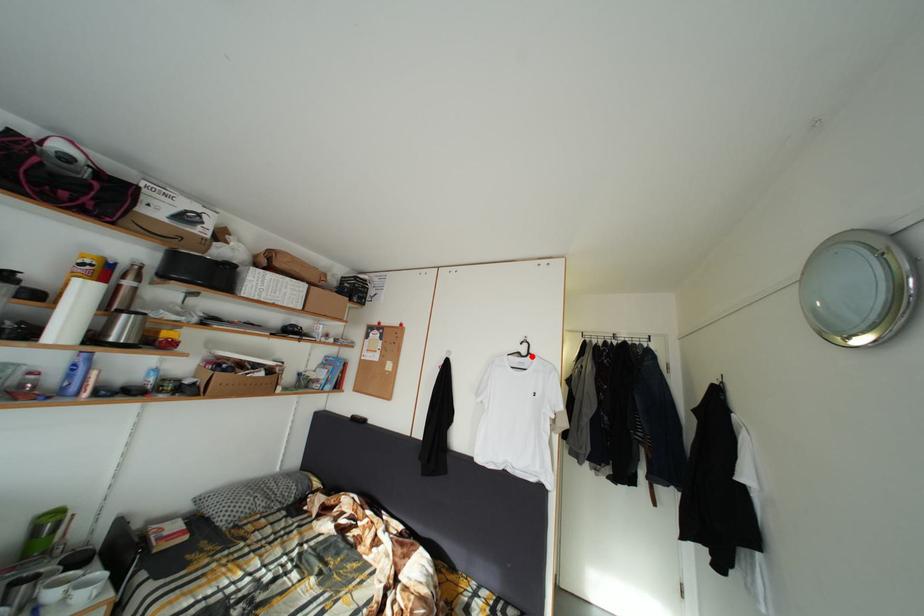
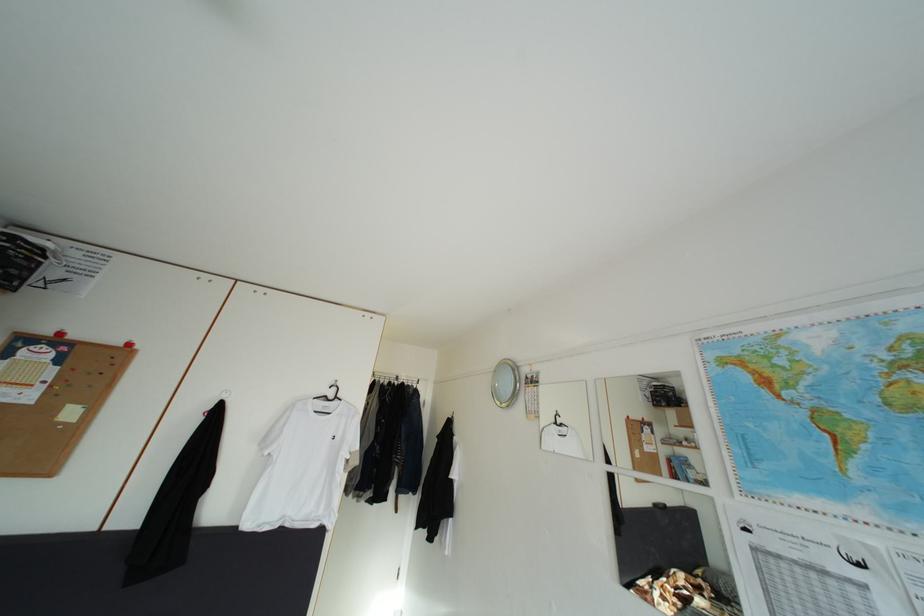
The point at the highlighted location is marked in the first image. Where is the corresponding point in the second image?

(339, 400)